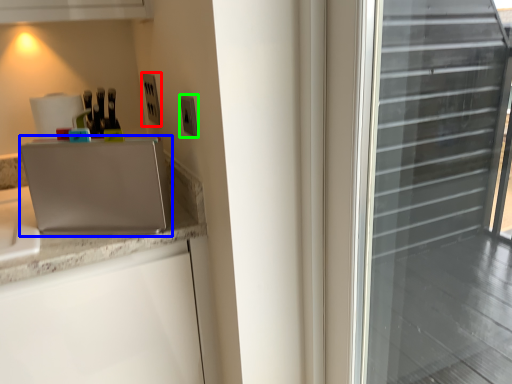
Question: Which object is positioned farthest from electric outlet (highlighted by a red box)? Select from appliance (highlighted by a blue box) and electric outlet (highlighted by a green box).

Choices:
 (A) appliance
 (B) electric outlet

Answer: (A)